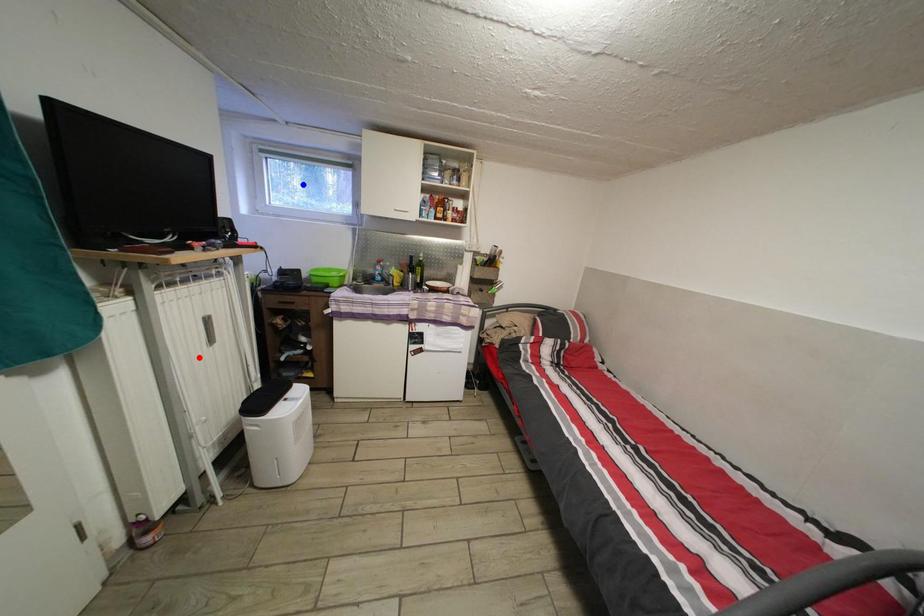
Question: In the image, two points are highlighted. Which point is nearer to the camera? Reply with the corresponding letter.

Choices:
 (A) blue point
 (B) red point

Answer: (B)